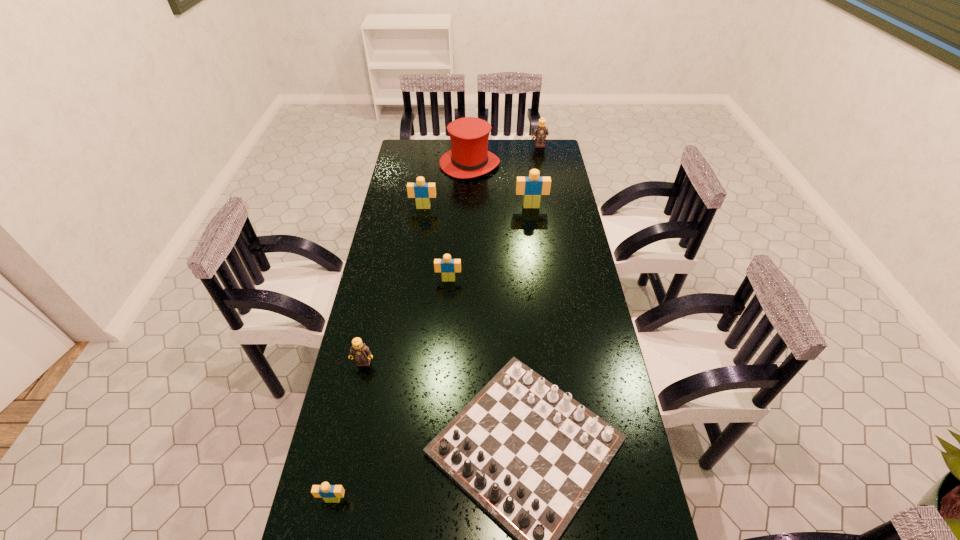
Where is `hat`? The image size is (960, 540). hat is located at coordinates (469, 157).

At what (x,y) coordinates should I click in order to perform the action: click on red hat. Please return your answer as a coordinate pair (x, y). Looking at the image, I should click on (469, 157).

Locate an element on the screen. The width and height of the screenshot is (960, 540). the biggest beige Lego is located at coordinates (532, 187).

The height and width of the screenshot is (540, 960). I want to click on the tallest Lego, so click(x=532, y=187).

Where is `the third smallest beige Lego`? the third smallest beige Lego is located at coordinates (422, 192).

This screenshot has height=540, width=960. Identify the location of the third Lego from left to right. (422, 192).

This screenshot has width=960, height=540. Identify the location of the farthest object. [x=540, y=131].

Find the location of a particular element. Image resolution: width=960 pixels, height=540 pixels. the farther tan Lego is located at coordinates (540, 131).

The width and height of the screenshot is (960, 540). Identify the location of the fourth nearest object. (447, 266).

The image size is (960, 540). Identify the location of the third nearest Lego. (447, 266).